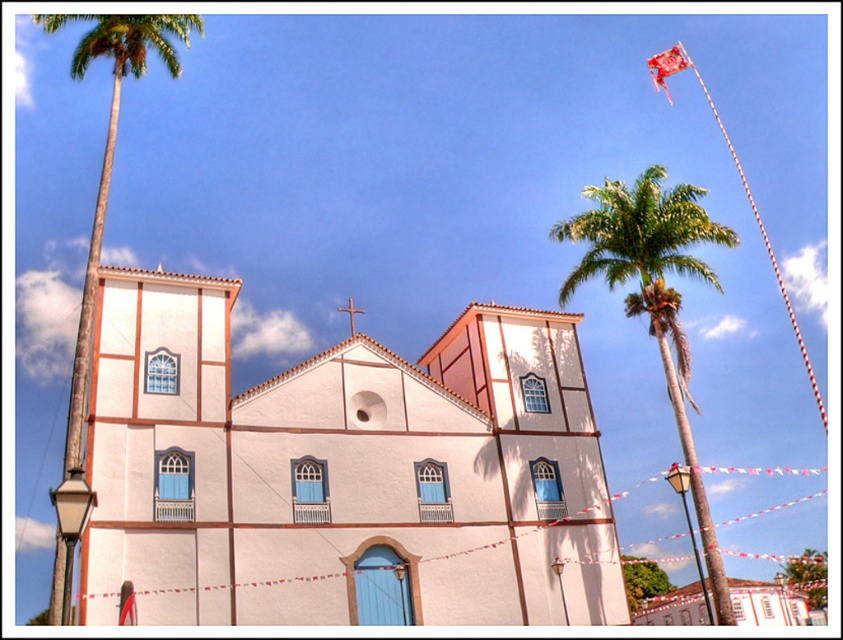
Question: Which of these objects is positioned farthest from the green leafy palm tree at left?

Choices:
 (A) white matte church at center
 (B) green leafy palm tree at right

Answer: (B)

Question: Which object is the farthest from the green leafy palm tree at right?

Choices:
 (A) white matte church at center
 (B) green leafy palm tree at left

Answer: (B)

Question: Can you confirm if white matte church at center is positioned below green leafy palm tree at left?

Choices:
 (A) no
 (B) yes

Answer: (A)

Question: Which point is farther to the camera?

Choices:
 (A) white matte church at center
 (B) green leafy palm tree at right

Answer: (B)

Question: Is green leafy palm tree at right further to camera compared to green leafy palm tree at left?

Choices:
 (A) no
 (B) yes

Answer: (B)

Question: Where is white matte church at center located in relation to green leafy palm tree at right in the image?

Choices:
 (A) right
 (B) left

Answer: (B)